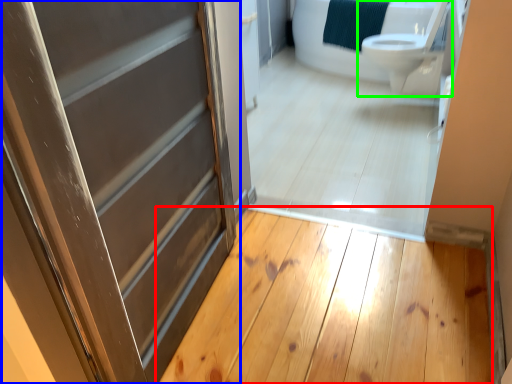
Question: Which is nearer to the plank (highlighted by a red box)? door (highlighted by a blue box) or toilet (highlighted by a green box).

Choices:
 (A) door
 (B) toilet

Answer: (A)